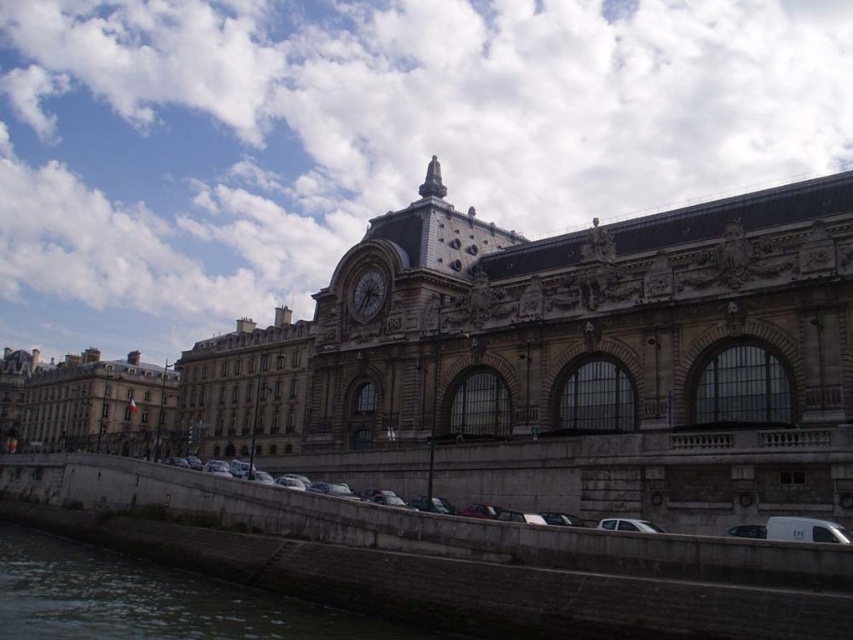
You are standing on the waterfront and looking at the stone building at left and the dark gray stone clock at center. Which object appears closer to the water?

The stone building at left appears closer to the water because it is positioned under the dark gray stone clock at center, indicating it is lower in elevation.

You are standing in front of the historic building and want to place a decorative statue on the dark gray concrete at lower left. However, you need to ensure it won not block the view of the dark gray stone clock at center from your current position. Can you confirm if placing the statue there would obstruct the view?

The dark gray concrete at lower left is to the left of the dark gray stone clock at center, so placing a statue on the dark gray concrete at lower left would not block the view of the dark gray stone clock at center from your current position.

You are an architect planning to place a decorative statue between the stone building at left and the dark gray stone clock at center. Given their sizes, which object should the statue be closer to?

The stone building at left is wider than the dark gray stone clock at center, so the statue should be placed closer to the dark gray stone clock at center to balance their widths.